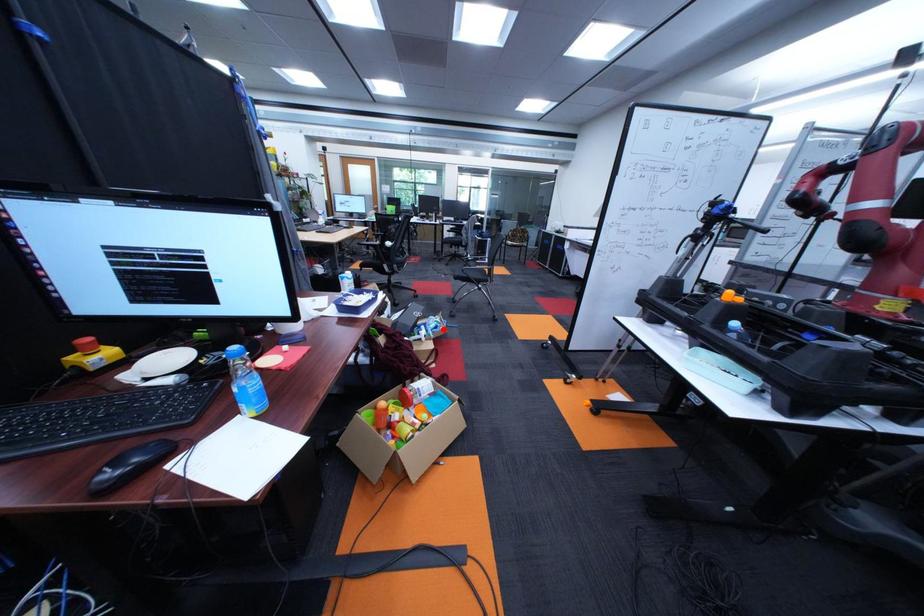
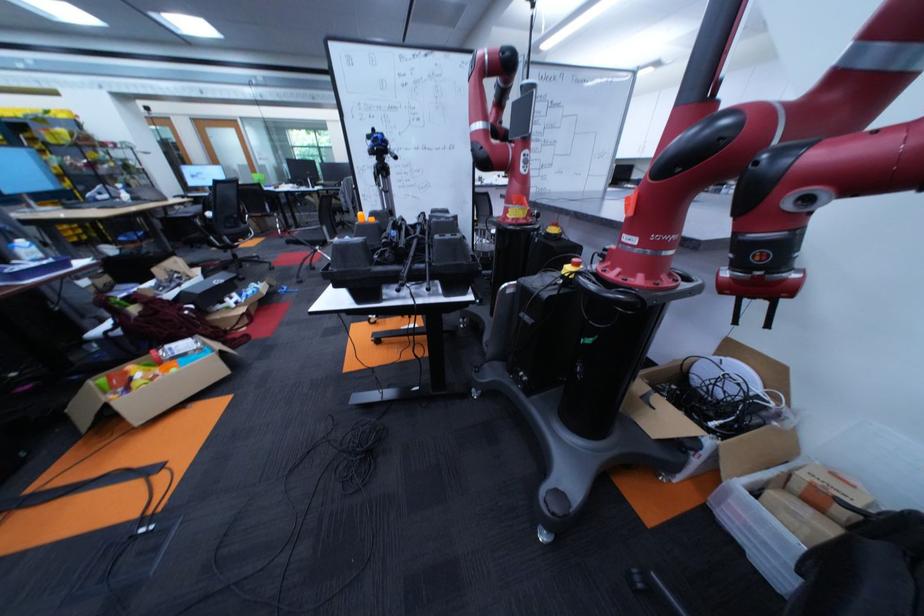
The point at the highlighted location is marked in the first image. Where is the corresponding point in the second image?

(258, 296)